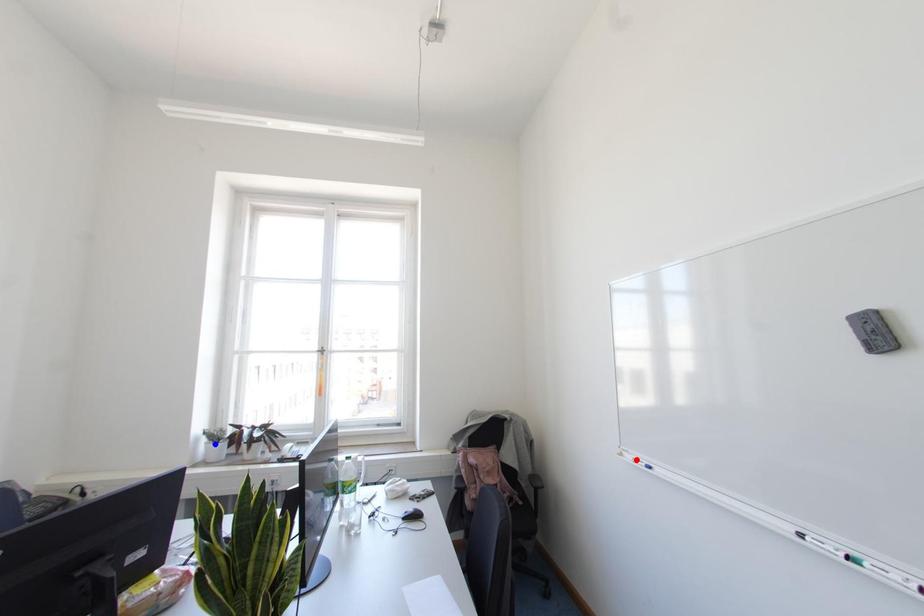
Question: In the image, two points are highlighted. Which point is nearer to the camera? Reply with the corresponding letter.

Choices:
 (A) blue point
 (B) red point

Answer: (B)